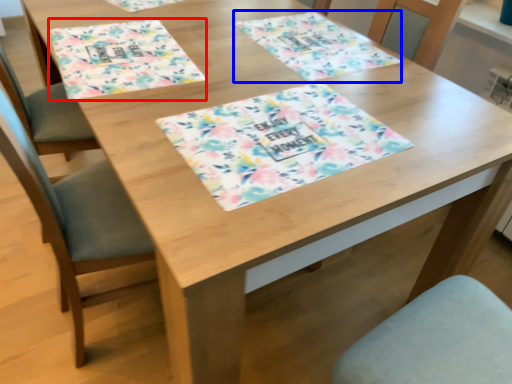
Question: Which object appears farthest to the camera in this image, place mat (highlighted by a red box) or place mat (highlighted by a blue box)?

Choices:
 (A) place mat
 (B) place mat

Answer: (B)